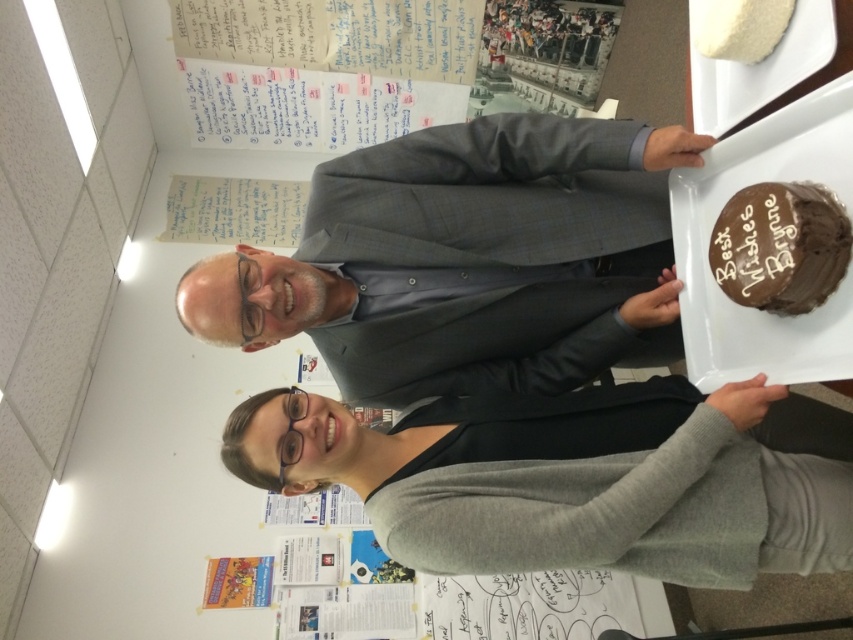
Looking at this image, you are standing in an office and see a point marked at coordinates (830, 426) in the image. If you want to place a 1.5 meter long banner horizontally between this point and your current position, will there be enough space?

The distance between the point and the viewer is 1.52 meters, so the 1.5 meter long banner can fit horizontally between the point and your current position with some space to spare.

Please describe the object located at the coordinates point (x=467, y=260) in the image.

The object located at point (x=467, y=260) is the matte gray suit at center.

You are a photographer who needs to capture both the gray woolen business suit at center and the chocolatesmoothcake at right in a single frame. Considering their sizes, which object should you zoom in more on to ensure both are clearly visible?

The gray woolen business suit at center is bigger than chocolatesmoothcake at right, so you should zoom in more on the chocolatesmoothcake at right to balance their sizes in the photo.